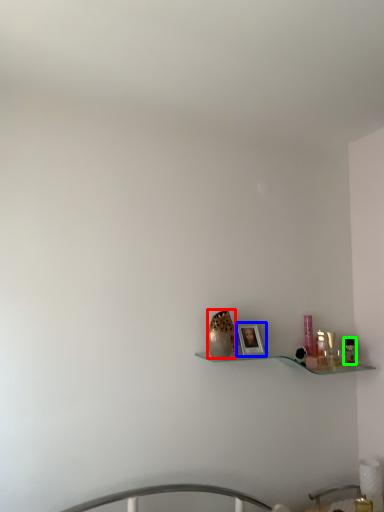
Question: Which object is positioned farthest from vase (highlighted by a red box)? Select from picture frame (highlighted by a blue box) and toiletry (highlighted by a green box).

Choices:
 (A) picture frame
 (B) toiletry

Answer: (B)